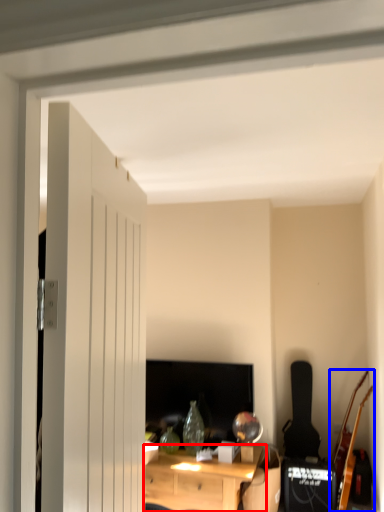
Question: Which of the following is the farthest to the observer, desk (highlighted by a red box) or guitar (highlighted by a blue box)?

Choices:
 (A) desk
 (B) guitar

Answer: (B)